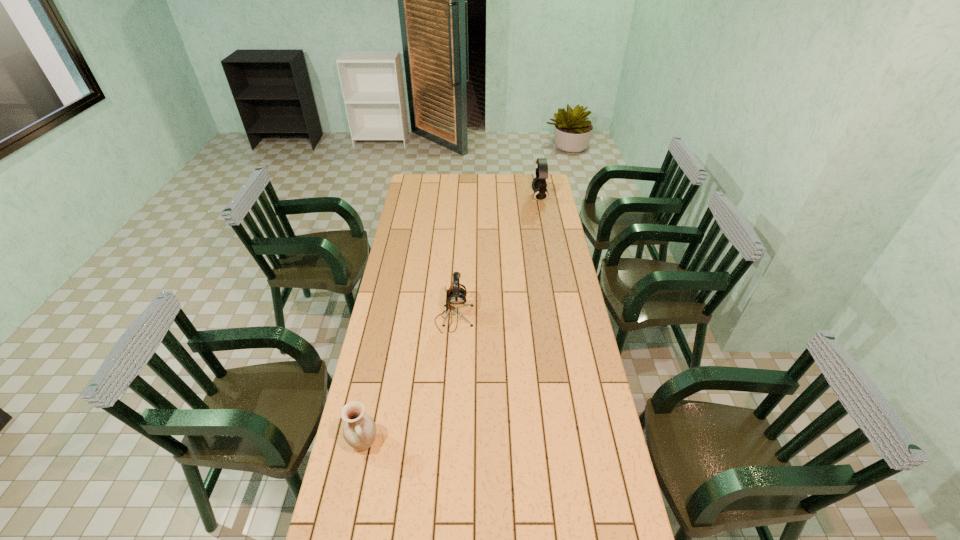
Locate an element on the screen. Image resolution: width=960 pixels, height=540 pixels. the right earphone is located at coordinates (539, 185).

This screenshot has height=540, width=960. In order to click on the farthest object in this screenshot , I will do `click(539, 185)`.

Locate an element on the screen. This screenshot has width=960, height=540. the left earphone is located at coordinates (455, 296).

This screenshot has width=960, height=540. I want to click on the second object from right to left, so click(x=455, y=296).

At what (x,y) coordinates should I click in order to perform the action: click on the leftmost object. Please return your answer as a coordinate pair (x, y). Looking at the image, I should click on (359, 431).

Where is `the shortest object`? Image resolution: width=960 pixels, height=540 pixels. the shortest object is located at coordinates click(359, 431).

Identify the location of free location located on the ear cups of the farthest object. (464, 197).

Find the location of a particular element. vacant space located 0.350m on the ear cups of the farthest object is located at coordinates (472, 197).

This screenshot has height=540, width=960. I want to click on free space located on the ear cups of the farthest object, so click(x=483, y=197).

This screenshot has width=960, height=540. Find the location of `vacant region located on the left of the nearer earphone`. vacant region located on the left of the nearer earphone is located at coordinates (414, 319).